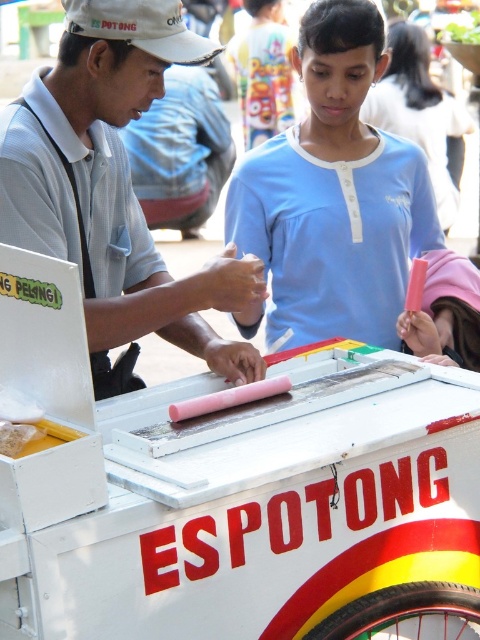
Does pink matte ice cream at center have a lesser height compared to white matte baseball cap at upper left?

In fact, pink matte ice cream at center may be taller than white matte baseball cap at upper left.

Does point (260, 243) come farther from viewer compared to point (131, 32)?

Yes.

Between point (407, 227) and point (85, 35), which one is positioned in front?

Positioned in front is point (85, 35).

You are a GUI agent. You are given a task and a screenshot of the screen. Output one action in this format:
    pyautogui.click(x=<x>, y=<y>)
    Task: Click on the pink matte ice cream at center
    The image size is (480, 640).
    Given the screenshot: What is the action you would take?
    pyautogui.click(x=335, y=195)

Is matte pink ice cream at center thinner than pink matte ice cream at center?

Yes.

Who is lower down, matte pink ice cream at center or pink matte ice cream at center?

Positioned lower is matte pink ice cream at center.

Between point (129, 64) and point (310, 61), which one is positioned behind?

The point (310, 61) is more distant.

The width and height of the screenshot is (480, 640). In order to click on matte pink ice cream at center in this screenshot , I will do `click(113, 186)`.

Between point (41, 120) and point (64, 1), which one is positioned behind?

Positioned behind is point (41, 120).

Is point (147, 240) closer to camera compared to point (157, 42)?

No.

You are a GUI agent. You are given a task and a screenshot of the screen. Output one action in this format:
    pyautogui.click(x=<x>, y=<y>)
    Task: Click on the matte pink ice cream at center
    The image size is (480, 640).
    Given the screenshot: What is the action you would take?
    pyautogui.click(x=113, y=186)